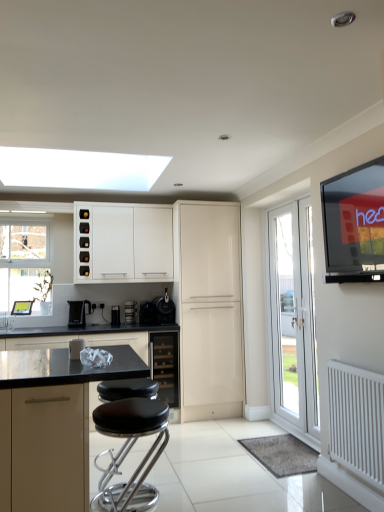
At what (x,y) coordinates should I click in order to perform the action: click on free space above white matte radiator at lower right (from a real-world perspective). Please return your answer as a coordinate pair (x, y). Looking at the image, I should click on (358, 361).